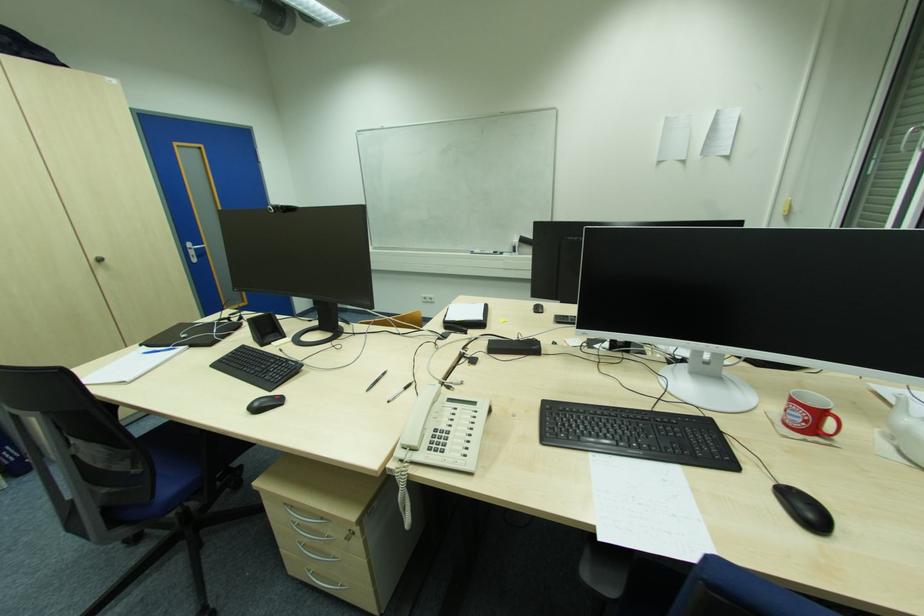
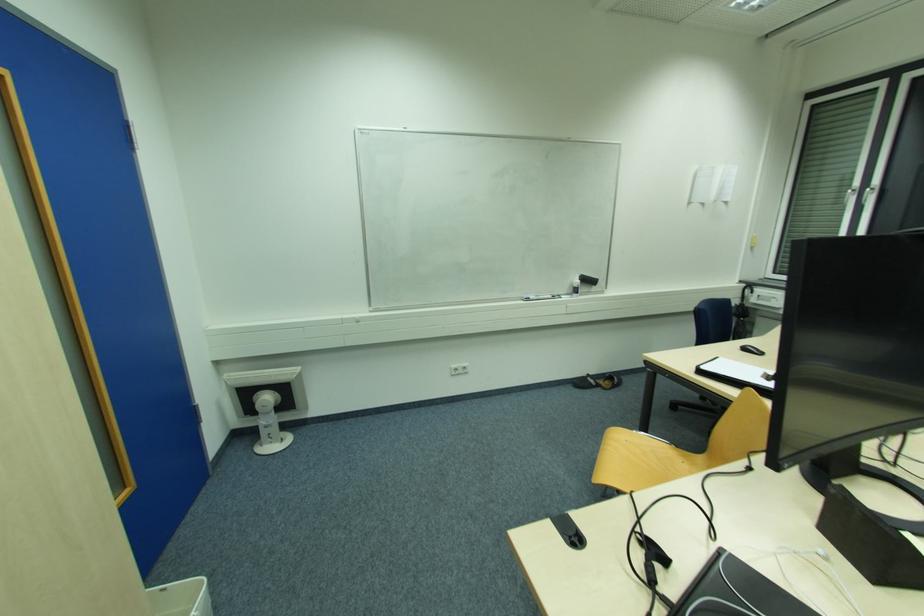
In the second image, find the point that corresponds to (x=517, y=243) in the first image.

(578, 282)